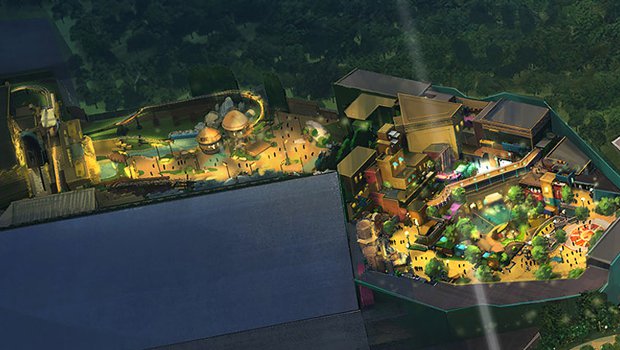
This screenshot has height=350, width=620. I want to click on windows, so click(x=459, y=129), click(x=462, y=125).